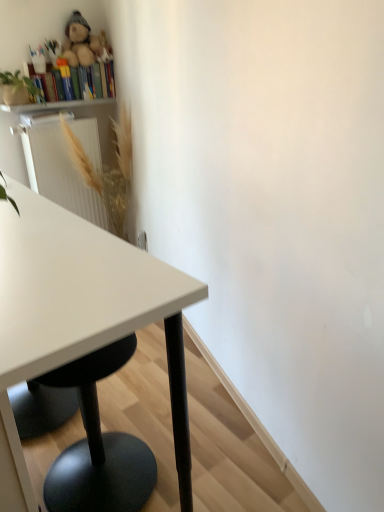
Question: Is wooden bookshelf at upper left not near white glossy table at left?

Choices:
 (A) no
 (B) yes

Answer: (B)

Question: Does wooden bookshelf at upper left have a lesser width compared to white glossy table at left?

Choices:
 (A) yes
 (B) no

Answer: (A)

Question: Is wooden bookshelf at upper left to the right of white glossy table at left from the viewer's perspective?

Choices:
 (A) yes
 (B) no

Answer: (B)

Question: From the image's perspective, would you say wooden bookshelf at upper left is shown under white glossy table at left?

Choices:
 (A) no
 (B) yes

Answer: (A)

Question: Does wooden bookshelf at upper left have a larger size compared to white glossy table at left?

Choices:
 (A) no
 (B) yes

Answer: (A)

Question: Is point (6, 336) closer or farther from the camera than point (1, 109)?

Choices:
 (A) closer
 (B) farther

Answer: (A)

Question: Relative to wooden bookshelf at upper left, is white glossy table at left in front or behind?

Choices:
 (A) behind
 (B) front

Answer: (B)

Question: From the image's perspective, relative to wooden bookshelf at upper left, is white glossy table at left above or below?

Choices:
 (A) above
 (B) below

Answer: (B)

Question: Considering the relative positions of white glossy table at left and wooden bookshelf at upper left in the image provided, is white glossy table at left to the left or to the right of wooden bookshelf at upper left?

Choices:
 (A) left
 (B) right

Answer: (B)

Question: Which is correct: wooden bookshelf at upper left is inside green matte plant at upper left, or outside of it?

Choices:
 (A) outside
 (B) inside

Answer: (A)

Question: Looking at the image, does wooden bookshelf at upper left seem bigger or smaller compared to green matte plant at upper left?

Choices:
 (A) big
 (B) small

Answer: (B)

Question: Considering the relative positions of wooden bookshelf at upper left and green matte plant at upper left in the image provided, is wooden bookshelf at upper left to the left or to the right of green matte plant at upper left?

Choices:
 (A) right
 (B) left

Answer: (A)

Question: Is point (14, 111) closer or farther from the camera than point (11, 81)?

Choices:
 (A) farther
 (B) closer

Answer: (A)

Question: Based on their sizes in the image, would you say golden textured plant at upper left is bigger or smaller than white glossy table at left?

Choices:
 (A) small
 (B) big

Answer: (A)

Question: From the image's perspective, is golden textured plant at upper left above or below white glossy table at left?

Choices:
 (A) above
 (B) below

Answer: (A)